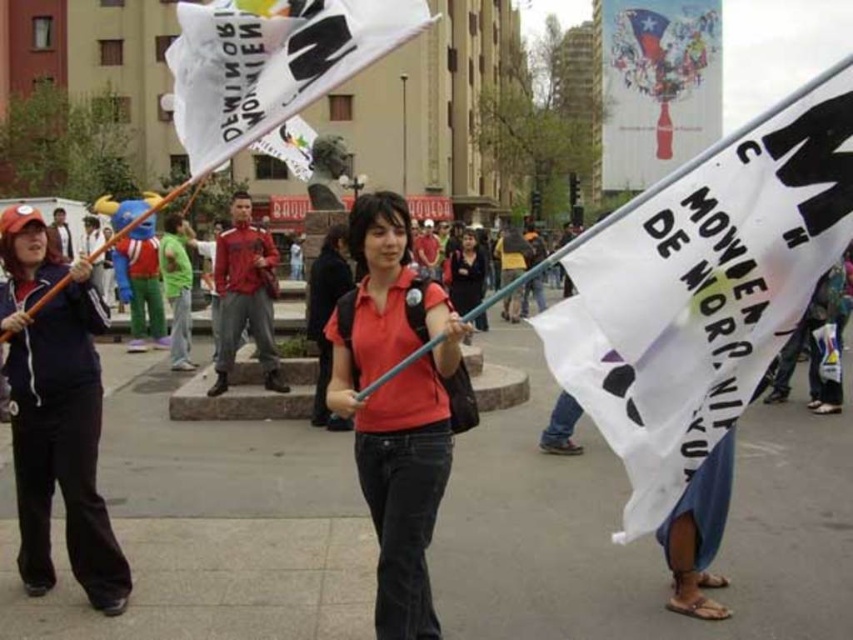
You are a photographer trying to capture a clear shot of the white paper flag at center and the matte red shirt at center. Based on their heights, which object should you focus on first if you want to ensure both are in frame without adjusting your camera angle?

The white paper flag at center has a lesser height compared to matte red shirt at center, so you should focus on the white paper flag at center first to ensure it is fully captured in the frame before adjusting for the taller matte red shirt at center.